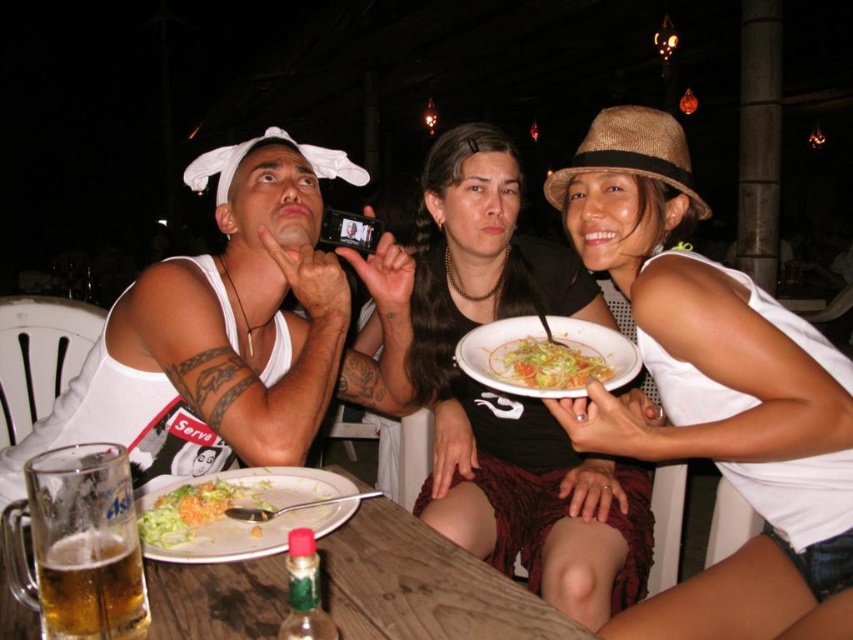
You are a fashion designer analyzing clothing items in an image. You notice two white tank tops. The first is labeled as the white matte tank top at upper right and the second as the white tank top at left. Based on their appearance, which one do you think has a more slender silhouette?

The white matte tank top at upper right has a more slender silhouette because it is described as thinner than the white tank top at left.

You are a waiter at the outdoor dining area. You need to deliver a new drink to the customer wearing the white matte tank top at upper right. The current drink at table left is foamy golden beer. Can you reach the customer without moving the foamy golden beer at table left?

The foamy golden beer at table left is behind the white matte tank top at upper right, so you can reach the customer wearing the white matte tank top at upper right without moving the foamy golden beer at table left.

You are a customer at this outdoor dining area and want to reach for the foamy golden beer at table left without spilling it. What should you be cautious of when reaching over the white matte tank top at upper right?

You should be cautious of the white matte tank top at upper right because it is positioned over the foamy golden beer at table left, so reaching over it might cause the beer to spill.